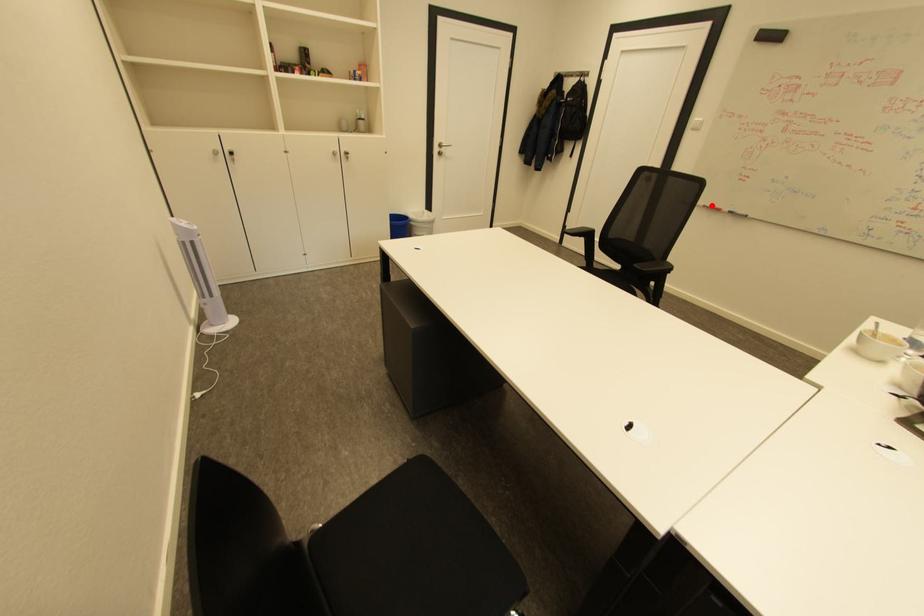
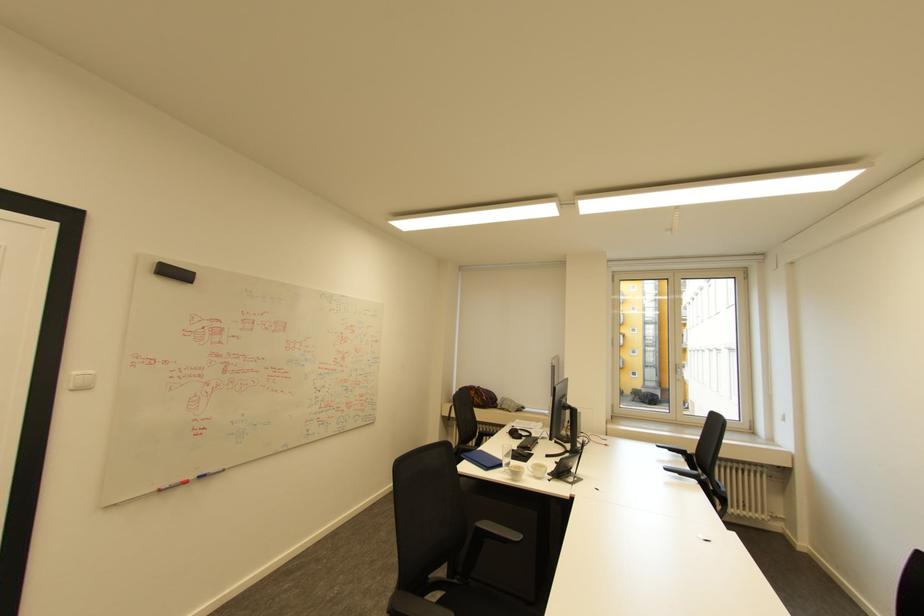
Locate, in the second image, the point that corresponds to the highlighted location in the first image.

(165, 490)